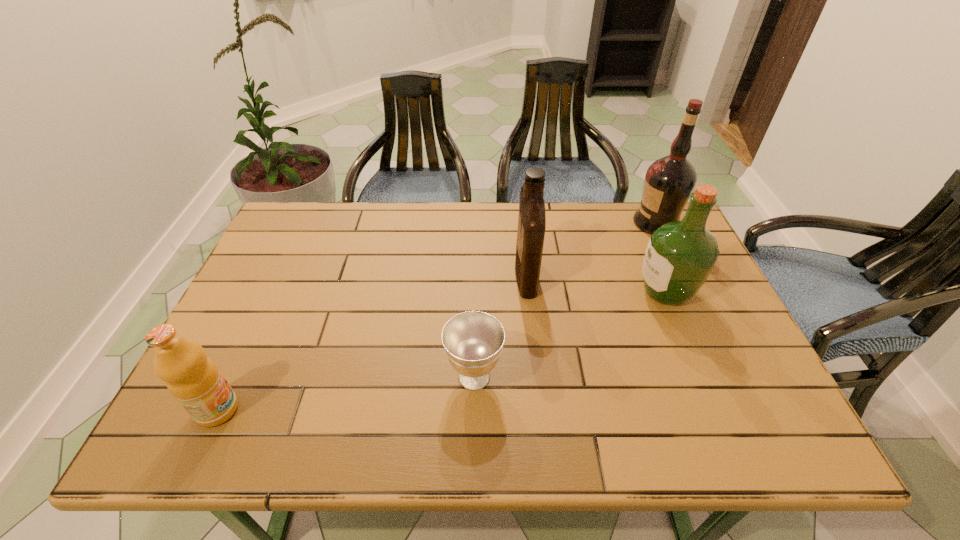
Locate an element on the screen. The image size is (960, 540). vacant region located 0.330m on the label side of the third object from left to right is located at coordinates (397, 274).

Find the location of a particular element. This screenshot has height=540, width=960. free location located 0.240m on the label side of the third object from left to right is located at coordinates (429, 274).

Where is `blank space located on the label side of the third object from left to right`? blank space located on the label side of the third object from left to right is located at coordinates (458, 274).

Where is `free point located on the front label of the second shortest object`? free point located on the front label of the second shortest object is located at coordinates (403, 410).

I want to click on blank space located 0.150m on the back of the fourth object from right to left, so click(475, 306).

This screenshot has height=540, width=960. In order to click on object that is at the far edge in this screenshot , I will do `click(669, 181)`.

This screenshot has width=960, height=540. I want to click on object that is at the near edge, so click(195, 381).

This screenshot has height=540, width=960. What are the coordinates of `object that is at the left edge` in the screenshot? It's located at (195, 381).

Where is `object that is at the near left corner`? This screenshot has width=960, height=540. object that is at the near left corner is located at coordinates (195, 381).

The image size is (960, 540). Identify the location of object present at the far right corner. (669, 181).